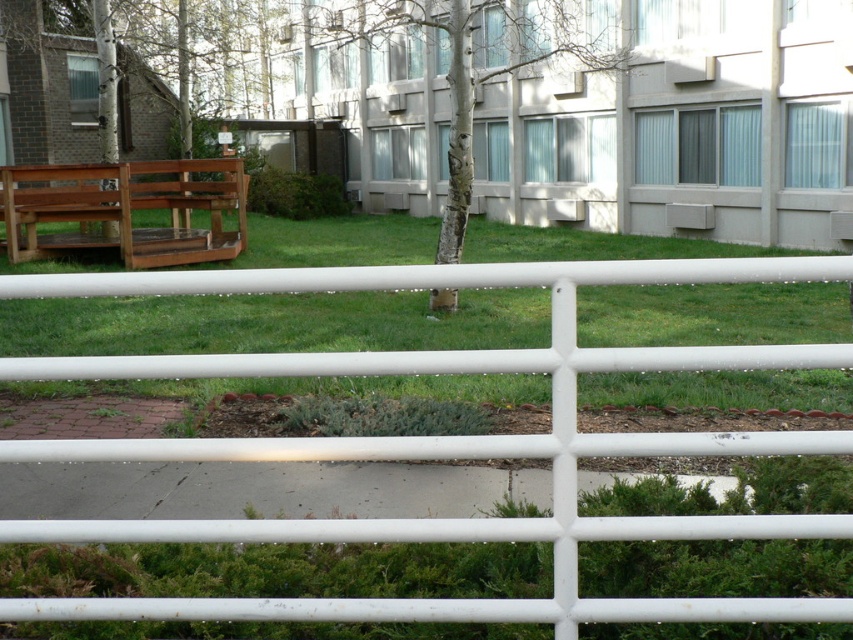
Question: Which object is positioned closest to the smooth bark tree at center?

Choices:
 (A) white metal fence at center
 (B) green grass at center
 (C) wooden bench at left

Answer: (B)

Question: Does green grass at center appear over smooth bark tree at center?

Choices:
 (A) no
 (B) yes

Answer: (A)

Question: Which of the following is the closest to the observer?

Choices:
 (A) green grass at center
 (B) smooth bark tree at center

Answer: (A)

Question: Is white metal fence at center to the left of wooden bench at left from the viewer's perspective?

Choices:
 (A) yes
 (B) no

Answer: (B)

Question: From the image, what is the correct spatial relationship of white metal fence at center in relation to smooth bark tree at center?

Choices:
 (A) left
 (B) right

Answer: (A)

Question: Which object is the closest to the green grass at center?

Choices:
 (A) white metal fence at center
 (B) wooden bench at left

Answer: (B)